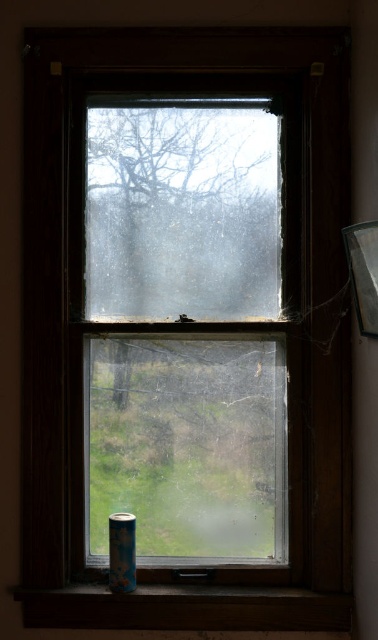
You are standing in a room and want to clean the transparent glass window at center. If your extendable pole is 5 feet long, can you reach the window without moving closer?

The distance between the transparent glass window at center and viewer is 5.13 feet, which is slightly longer than the 5 feet extendable pole. Therefore, you cannot reach the window without moving closer.

You are an interior designer assessing the window and wooden frame in the scene. Based on their sizes, which one would require more material to replace entirely? Please consider the transparent glass window at center and the wooden at lower center.

The transparent glass window at center has a larger size compared to wooden at lower center, so replacing it would require more material.

You are an interior designer assessing the window in the image. You need to determine which material is thinner between the transparent glass window at center and the wooden at lower center. Which one is thinner?

The transparent glass window at center is thinner than the wooden at lower center according to the description.